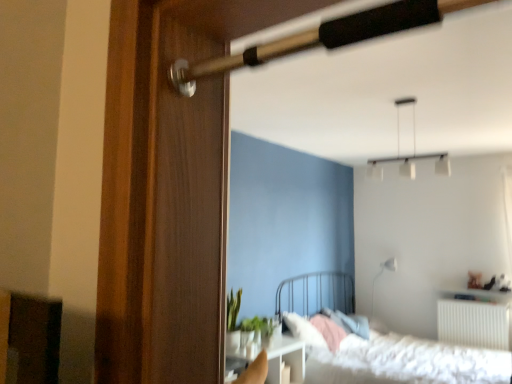
Question: Considering the positions of green matte plant at center and white glossy table at lower center in the image, is green matte plant at center taller or shorter than white glossy table at lower center?

Choices:
 (A) tall
 (B) short

Answer: (B)

Question: Considering their positions, is green matte plant at center located in front of or behind white glossy table at lower center?

Choices:
 (A) behind
 (B) front

Answer: (A)

Question: Considering the real-world distances, which object is farthest from the wooden door handle at upper center?

Choices:
 (A) white matte pendant light at upper center, the 1th lamp from the top
 (B) white fluffy bed at lower right
 (C) white glossy table at lower center
 (D) green matte plant at center
 (E) wooden cabinet at lower left

Answer: (A)

Question: Estimate the real-world distances between objects in this image. Which object is farther from the wooden cabinet at lower left?

Choices:
 (A) green matte plant at center
 (B) white glossy lamp at upper right, marked as the 1th lamp in a bottom-to-top arrangement
 (C) white glossy table at lower center
 (D) wooden screen door at left
 (E) wooden door handle at upper center

Answer: (B)